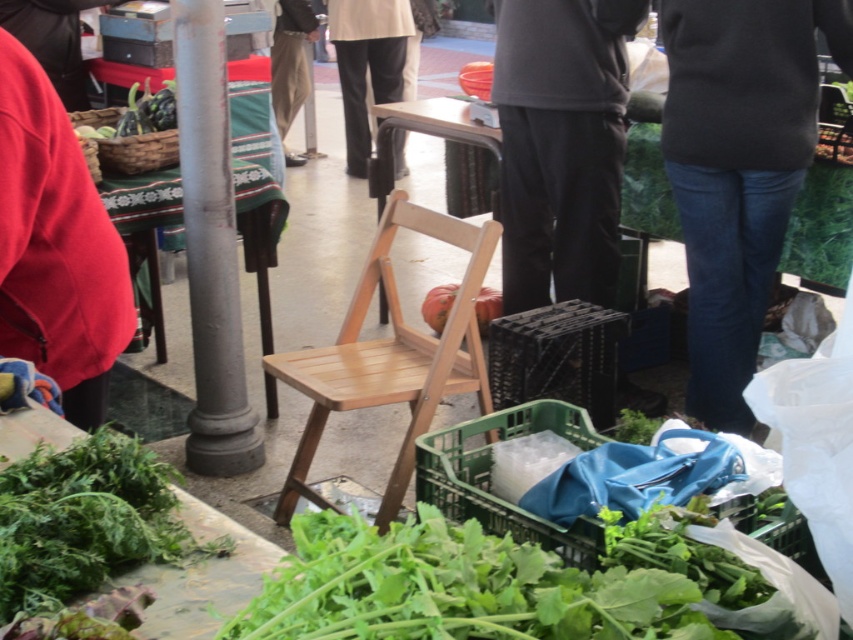
You are a customer at the market and want to pick up both the dark gray sweater at upper right and the smooth orange pumpkin at center. If you can carry both items in one trip, how far apart are they from each other?

The dark gray sweater at upper right and the smooth orange pumpkin at center are 4.34 feet apart.

You are a customer at the market and want to buy both the green leafy vegetable at upper left and the smooth orange pumpkin at center. Which one is taller?

The green leafy vegetable at upper left is taller than the smooth orange pumpkin at center.

You are a customer at the market and want to pick up both the green leafy at lower left and the dark gray pants at center. Which item should you reach for first if you want to grab the one closer to you?

The green leafy at lower left is closer to the viewer than the dark gray pants at center, so you should reach for the green leafy at lower left first.